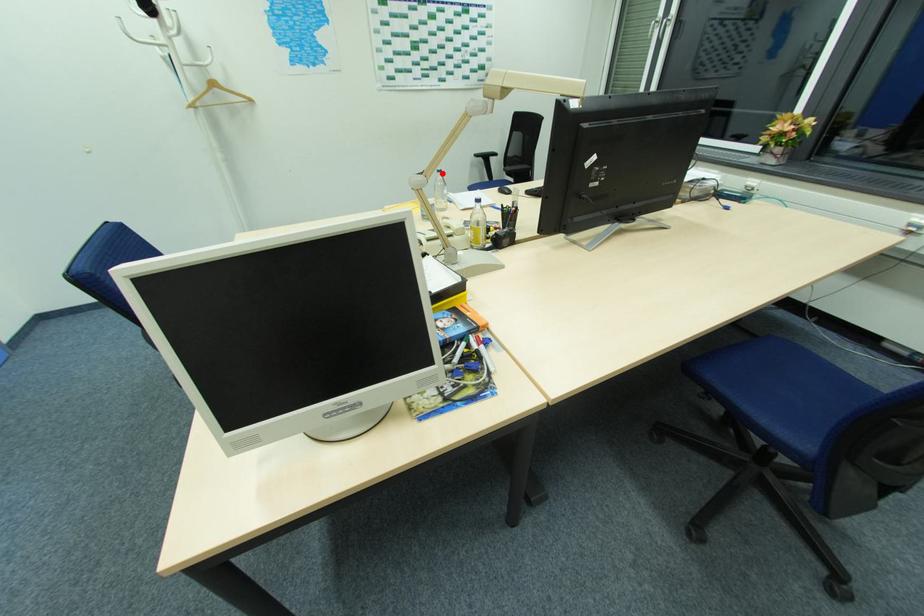
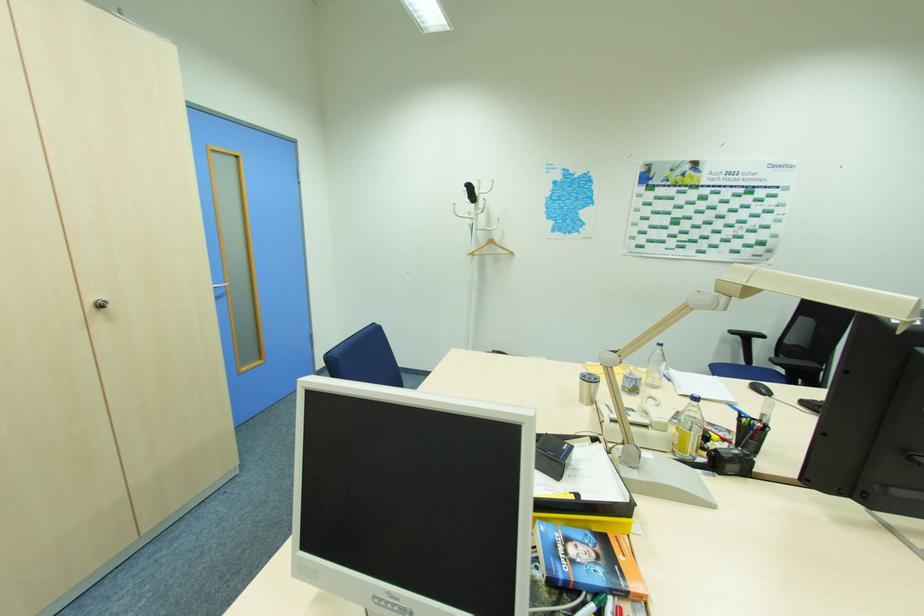
Question: A red point is marked in image1. In image2, is the corresponding 3D point closer to the camera or farther? Reply with the corresponding letter.

Choices:
 (A) The corresponding 3D point is closer.
 (B) The corresponding 3D point is farther.

Answer: (B)